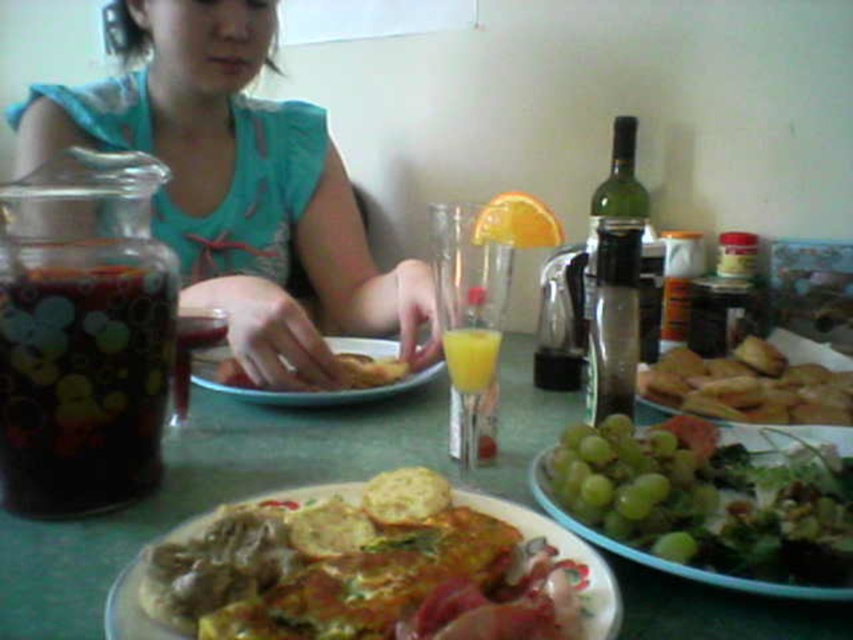
You are a person with a 24 inch arm length. You want to grab the white ceramic plate at center from your current position. Can you reach it?

The white ceramic plate at center is 27.41 inches away from you. Since your arm is only 24 inches long, you cannot reach it without moving closer.

You are a chef preparing to place a 9 inch diameter saucer on the table. You want to ensure there is enough space between the white ceramic plate at center and the yellow translucent glass at center. Can you fit the saucer between them without moving either object?

The white ceramic plate at center and yellow translucent glass at center are 9.52 inches apart. Since the saucer is 9 inches in diameter, the distance between them is sufficient to place the saucer between them without moving either object.

You are setting up a table for a breakfast buffet and need to arrange items according to their sizes. Given the green leafy salad at lower right and the dark red glass at center, which item should you place first in the display if you want to start with the wider item?

The green leafy salad at lower right should be placed first because its width is larger than the dark red glass at center.